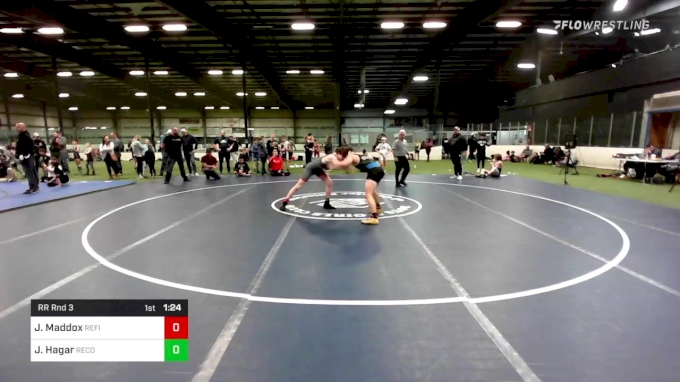
In order to click on light in this screenshot , I will do `click(313, 71)`, `click(286, 71)`.